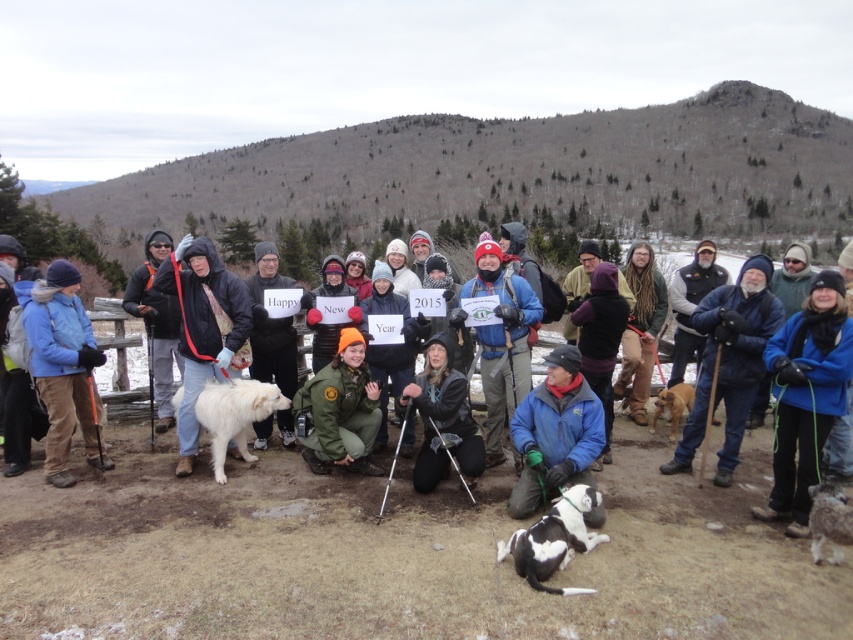
Does matte blue jacket at center have a lesser width compared to blue fleece jacket at left?

Incorrect, matte blue jacket at center's width is not less than blue fleece jacket at left's.

Who is shorter, matte blue jacket at center or blue fleece jacket at left?

matte blue jacket at center

You are a GUI agent. You are given a task and a screenshot of the screen. Output one action in this format:
    pyautogui.click(x=<x>, y=<y>)
    Task: Click on the matte blue jacket at center
    
    Given the screenshot: What is the action you would take?
    pyautogui.click(x=241, y=508)

Between green uniform at center and black leather jacket at center, which one appears on the left side from the viewer's perspective?

From the viewer's perspective, green uniform at center appears more on the left side.

Based on the photo, who is more forward, [331,387] or [471,476]?

Positioned in front is point [471,476].

Is point (363, 449) positioned behind point (428, 468)?

That is True.

The image size is (853, 640). In order to click on green uniform at center in this screenshot , I will do `click(340, 410)`.

Which is below, blue fleece jacket at left or matte black jacket at center?

Positioned lower is matte black jacket at center.

Is the position of blue fleece jacket at left more distant than that of matte black jacket at center?

No.

Between point (36, 310) and point (166, 285), which one is positioned behind?

The point (166, 285) is behind.

This screenshot has height=640, width=853. Identify the location of blue fleece jacket at left. (62, 365).